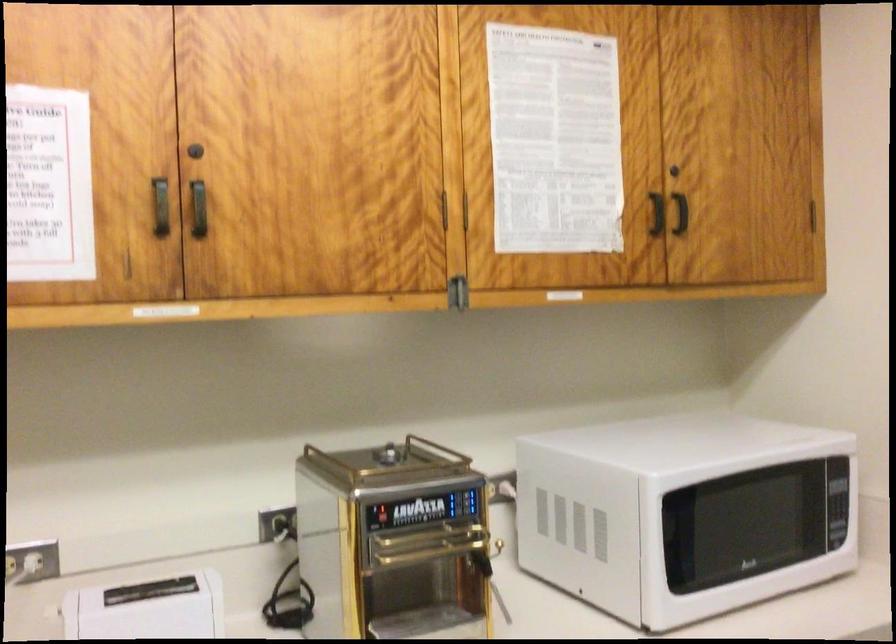
Find the location of `metal cabinet latch`. metal cabinet latch is located at coordinates (x=458, y=292).